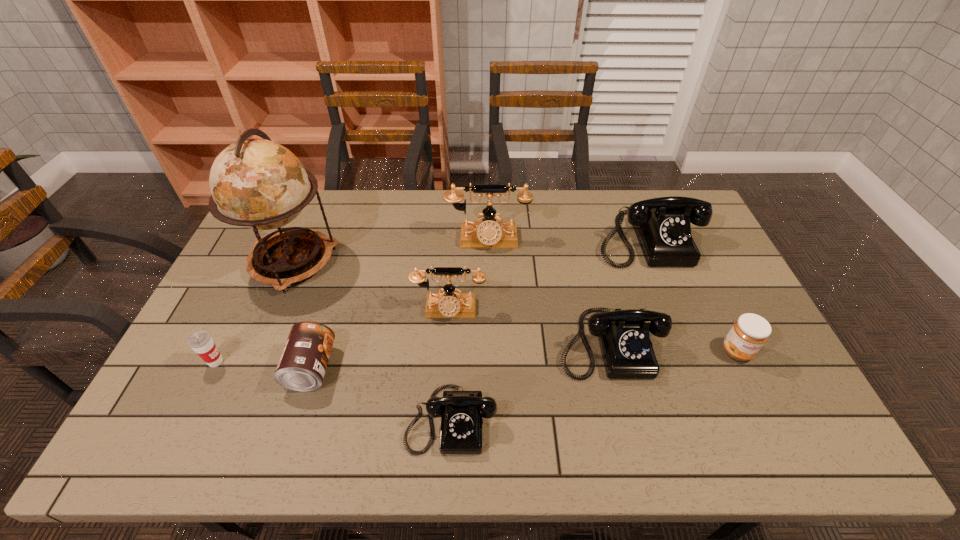
At what (x,y) coordinates should I click in order to perform the action: click on free space at the near right corner. Please return your answer as a coordinate pair (x, y). This screenshot has width=960, height=540. Looking at the image, I should click on (806, 438).

What are the coordinates of `free space between the bigger beige telephone and the smaller beige telephone` in the screenshot? It's located at (468, 275).

The height and width of the screenshot is (540, 960). In order to click on free point between the nearest black telephone and the second tallest object in this screenshot , I will do `click(469, 329)`.

The width and height of the screenshot is (960, 540). Identify the location of blank region between the orange jam and the shortest telephone. (594, 385).

What are the coordinates of `free space between the shortest telephone and the second nearest black telephone` in the screenshot? It's located at (530, 381).

Locate an element on the screen. This screenshot has height=540, width=960. vacant space in between the farther beige telephone and the shortest telephone is located at coordinates (469, 329).

Where is `empty space that is in between the can and the cup`? empty space that is in between the can and the cup is located at coordinates (264, 365).

The image size is (960, 540). What are the coordinates of `empty location between the nearer beige telephone and the farthest black telephone` in the screenshot? It's located at (548, 274).

Locate an element on the screen. Image resolution: width=960 pixels, height=540 pixels. free space between the nearer beige telephone and the second smallest black telephone is located at coordinates tap(529, 327).

Where is `vacant space that is in between the second farthest black telephone and the can`? vacant space that is in between the second farthest black telephone and the can is located at coordinates (460, 355).